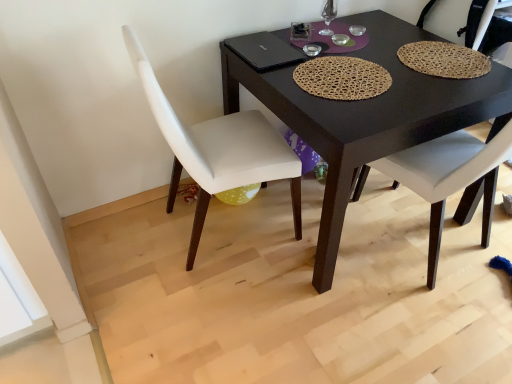
The width and height of the screenshot is (512, 384). In order to click on black matte table at center in this screenshot , I will do `click(367, 115)`.

This screenshot has width=512, height=384. Describe the element at coordinates (218, 149) in the screenshot. I see `white leather chair at lower left, the 1th chair positioned from the left` at that location.

The height and width of the screenshot is (384, 512). What are the coordinates of `white leather chair at center, the 1th chair from the right` in the screenshot? It's located at (487, 20).

Image resolution: width=512 pixels, height=384 pixels. Find the location of `black matte table at center`. black matte table at center is located at coordinates (367, 115).

Can you confirm if black matte table at center is bigger than white leather chair at lower left, the 2th chair when ordered from right to left?

Yes.

Locate an element on the screen. The height and width of the screenshot is (384, 512). table above the white leather chair at lower left, the 2th chair when ordered from right to left (from the image's perspective) is located at coordinates (367, 115).

Between black matte table at center and white leather chair at lower left, the 2th chair when ordered from right to left, which one is positioned in front?

white leather chair at lower left, the 2th chair when ordered from right to left.

Which is behind, white leather chair at lower left, the 2th chair when ordered from right to left, or black matte table at center?

black matte table at center is further from the camera.

Considering the sizes of objects white leather chair at lower left, the 2th chair when ordered from right to left, and black matte table at center in the image provided, who is smaller, white leather chair at lower left, the 2th chair when ordered from right to left, or black matte table at center?

With smaller size is white leather chair at lower left, the 2th chair when ordered from right to left.

Is white leather chair at lower left, the 2th chair when ordered from right to left, in contact with black matte table at center?

No, white leather chair at lower left, the 2th chair when ordered from right to left, is not beside black matte table at center.

Which object is positioned more to the right, white leather chair at lower left, the 2th chair when ordered from right to left, or black matte table at center?

black matte table at center.

Is white leather chair at center, the 1th chair from the right, not near white leather chair at lower left, the 1th chair positioned from the left?

white leather chair at center, the 1th chair from the right, is positioned a significant distance from white leather chair at lower left, the 1th chair positioned from the left.

Does white leather chair at center, the 1th chair from the right, have a greater height compared to white leather chair at lower left, the 2th chair when ordered from right to left?

In fact, white leather chair at center, the 1th chair from the right, may be shorter than white leather chair at lower left, the 2th chair when ordered from right to left.

Is white leather chair at lower left, the 2th chair when ordered from right to left, surrounded by white leather chair at center, which ranks as the second chair in left-to-right order?

No, white leather chair at center, which ranks as the second chair in left-to-right order, does not contain white leather chair at lower left, the 2th chair when ordered from right to left.

From a real-world perspective, which object stands above the other?

white leather chair at lower left, the 1th chair positioned from the left.

How far apart are white leather chair at lower left, the 1th chair positioned from the left, and white leather chair at center, the 1th chair from the right?

3.99 feet.

Could you tell me if white leather chair at lower left, the 2th chair when ordered from right to left, is facing white leather chair at center, the 1th chair from the right?

Yes, white leather chair at lower left, the 2th chair when ordered from right to left, is oriented towards white leather chair at center, the 1th chair from the right.

Considering the sizes of objects white leather chair at lower left, the 2th chair when ordered from right to left, and white leather chair at center, which ranks as the second chair in left-to-right order, in the image provided, who is smaller, white leather chair at lower left, the 2th chair when ordered from right to left, or white leather chair at center, which ranks as the second chair in left-to-right order,?

white leather chair at lower left, the 2th chair when ordered from right to left.

Between point (218, 170) and point (424, 15), which one is positioned in front?

The point (218, 170) is closer.

How distant is white leather chair at center, the 1th chair from the right, from black matte table at center?

The distance of white leather chair at center, the 1th chair from the right, from black matte table at center is 73.96 centimeters.

In the image, there is a white leather chair at center, the 1th chair from the right. Identify the location of table below it (from the image's perspective). This screenshot has width=512, height=384. (367, 115).

Is point (354, 184) positioned behind point (398, 122)?

Yes, point (354, 184) is behind point (398, 122).

Considering the sizes of objects white leather chair at center, which ranks as the second chair in left-to-right order, and black matte table at center in the image provided, who is shorter, white leather chair at center, which ranks as the second chair in left-to-right order, or black matte table at center?

black matte table at center is shorter.

Is black matte table at center far away from white leather chair at center, which ranks as the second chair in left-to-right order?

They are positioned close to each other.

Considering the points (454, 123) and (479, 41), which point is in front, point (454, 123) or point (479, 41)?

The point (454, 123) is closer to the camera.

Which of these two, black matte table at center or white leather chair at center, which ranks as the second chair in left-to-right order, stands taller?

white leather chair at center, which ranks as the second chair in left-to-right order, is taller.

Image resolution: width=512 pixels, height=384 pixels. In order to click on chair above the black matte table at center (from the image's perspective) in this screenshot , I will do `click(487, 20)`.

The image size is (512, 384). I want to click on chair that appears in front of the black matte table at center, so click(218, 149).

You are a GUI agent. You are given a task and a screenshot of the screen. Output one action in this format:
    pyautogui.click(x=<x>, y=<y>)
    Task: Click on the table that is on the right side of white leather chair at lower left, the 1th chair positioned from the left
    The width and height of the screenshot is (512, 384).
    Given the screenshot: What is the action you would take?
    pyautogui.click(x=367, y=115)

Consider the image. Based on their spatial positions, is white leather chair at lower left, the 1th chair positioned from the left, or black matte table at center closer to white leather chair at center, which ranks as the second chair in left-to-right order?

Among the two, black matte table at center is located nearer to white leather chair at center, which ranks as the second chair in left-to-right order.

In the scene shown: Estimate the real-world distances between objects in this image. Which object is further from white leather chair at lower left, the 1th chair positioned from the left, white leather chair at center, the 1th chair from the right, or black matte table at center?

white leather chair at center, the 1th chair from the right.

Considering their positions, is black matte table at center positioned further to white leather chair at center, the 1th chair from the right, than white leather chair at lower left, the 1th chair positioned from the left?

white leather chair at lower left, the 1th chair positioned from the left.

When comparing their distances from white leather chair at lower left, the 1th chair positioned from the left, does black matte table at center or white leather chair at center, the 1th chair from the right, seem further?

white leather chair at center, the 1th chair from the right.

Based on their spatial positions, is white leather chair at lower left, the 1th chair positioned from the left, or white leather chair at center, which ranks as the second chair in left-to-right order, further from black matte table at center?

Among the two, white leather chair at center, which ranks as the second chair in left-to-right order, is located further to black matte table at center.

Looking at the image, which one is located closer to black matte table at center, white leather chair at center, the 1th chair from the right, or white leather chair at lower left, the 1th chair positioned from the left?

white leather chair at lower left, the 1th chair positioned from the left, is closer to black matte table at center.

Image resolution: width=512 pixels, height=384 pixels. I want to click on table between white leather chair at lower left, the 1th chair positioned from the left, and white leather chair at center, which ranks as the second chair in left-to-right order, so click(x=367, y=115).